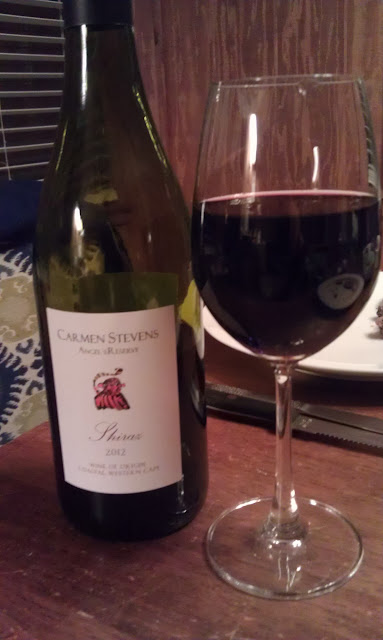
Find the location of `cushion`. cushion is located at coordinates (16, 360).